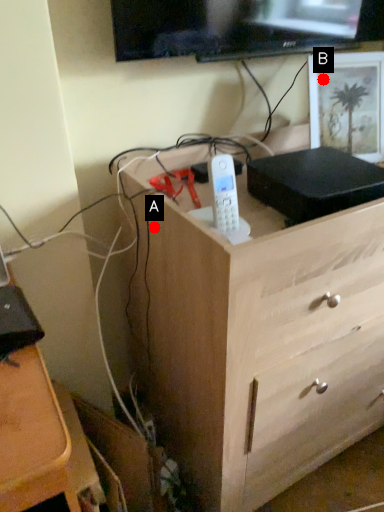
Question: Two points are circled on the image, labeled by A and B beside each circle. Which of the following is the closest to the observer?

Choices:
 (A) A is closer
 (B) B is closer

Answer: (A)